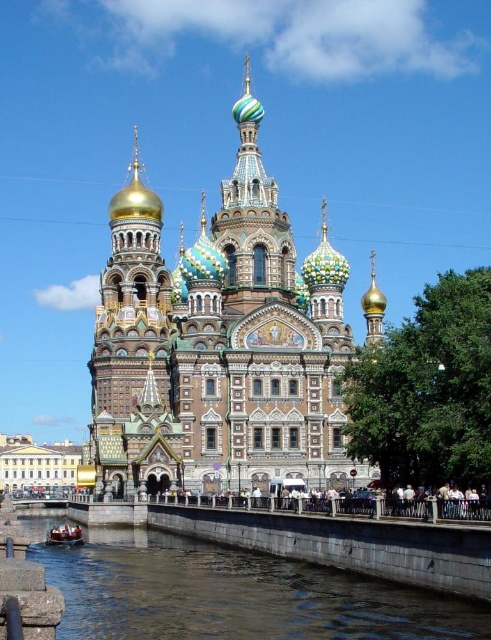
Between clear water at lower center and metallic polished boat at lower left, which one has less height?

clear water at lower center is shorter.

Looking at this image, measure the distance between point (410, 588) and camera.

They are 62.26 meters apart.

Consider the image. Who is more distant from viewer, (93, 540) or (81, 529)?

The point (81, 529) is behind.

Identify the location of clear water at lower center. (230, 593).

Can you confirm if gold mosaic church at center is wider than clear water at lower center?

Yes, gold mosaic church at center is wider than clear water at lower center.

Is point (327, 396) closer to camera compared to point (348, 605)?

No, it is behind (348, 605).

Which is behind, point (328, 413) or point (151, 625)?

The point (328, 413) is more distant.

This screenshot has height=640, width=491. Find the location of `gold mosaic church at center`. gold mosaic church at center is located at coordinates (218, 346).

How much distance is there between gold mosaic church at center and metallic polished boat at lower left?

25.05 meters

Who is lower down, gold mosaic church at center or metallic polished boat at lower left?

Positioned lower is metallic polished boat at lower left.

Is point (137, 172) farther from viewer compared to point (55, 540)?

Yes, it is.

Locate an element on the screen. The width and height of the screenshot is (491, 640). gold mosaic church at center is located at coordinates click(218, 346).